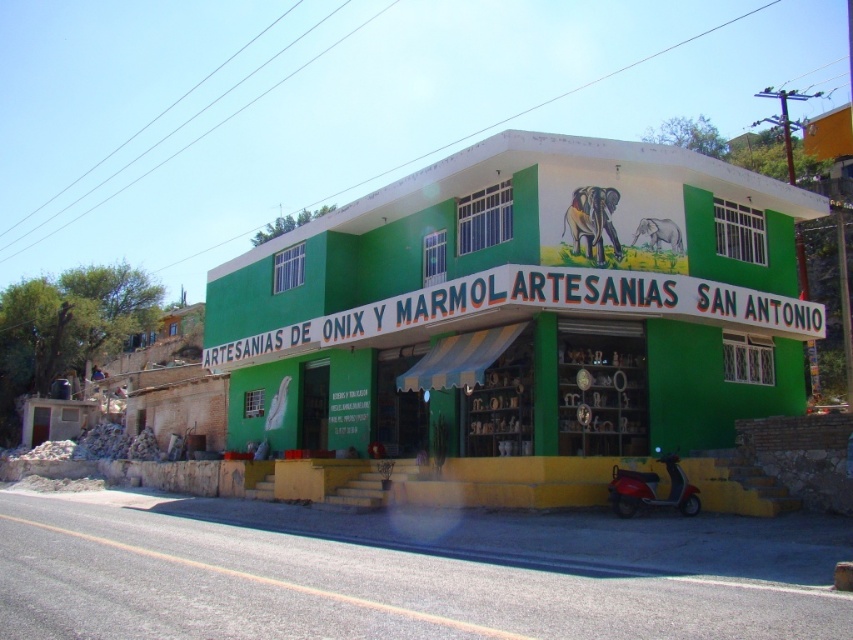
You are standing at the point marked by the coordinate point at (782, 346). You want to walk to the entrance of the shop, which is located at the base of the building. How far will you have to walk in feet?

The distance between the point marked by the coordinate point at (782, 346) and the entrance of the shop is 68.10 feet.

You are standing at the entrance of a nearby park and want to take a photo of the green matte building at center. If your camera has a maximum focus range of 15 meters, will it be able to capture the building clearly?

The green matte building at center is 14.86 meters away from camera, so yes, the camera can focus on it clearly within the 15 meters range.

Based on the photo, you are a delivery person trying to park your metallic red scooter at lower right near the green matte building at center. Since the building is closer to you, will the scooter be behind or in front of the building when parked?

The green matte building at center is closer to the viewer than the metallic red scooter at lower right, so when parked, the scooter will be behind the building.